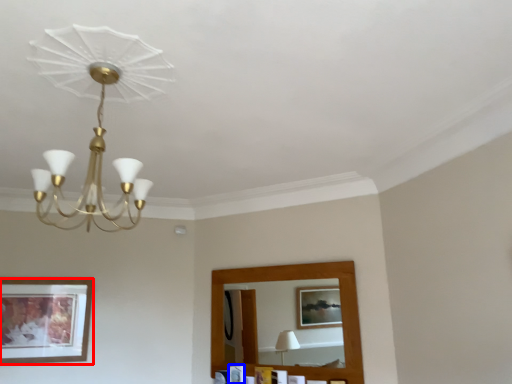
Question: Which object is further to the camera taking this photo, picture frame (highlighted by a red box) or picture frame (highlighted by a blue box)?

Choices:
 (A) picture frame
 (B) picture frame

Answer: (B)